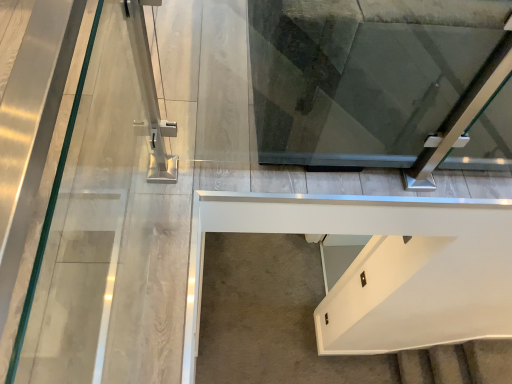
What do you see at coordinates (354, 81) in the screenshot?
I see `clear glass door at upper center` at bounding box center [354, 81].

This screenshot has width=512, height=384. In order to click on clear glass door at upper center in this screenshot , I will do `click(354, 81)`.

Where is `clear glass door at upper center`? The image size is (512, 384). clear glass door at upper center is located at coordinates (354, 81).